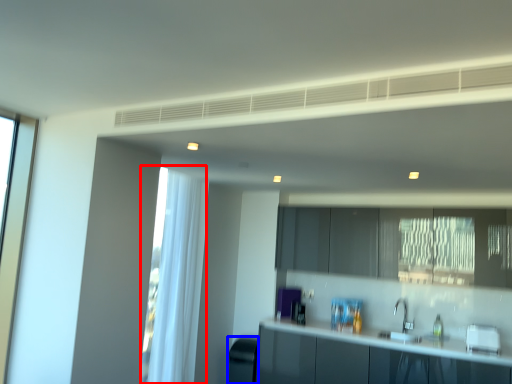
Question: Which object is closer to the camera taking this photo, curtain (highlighted by a red box) or appliance (highlighted by a blue box)?

Choices:
 (A) curtain
 (B) appliance

Answer: (A)